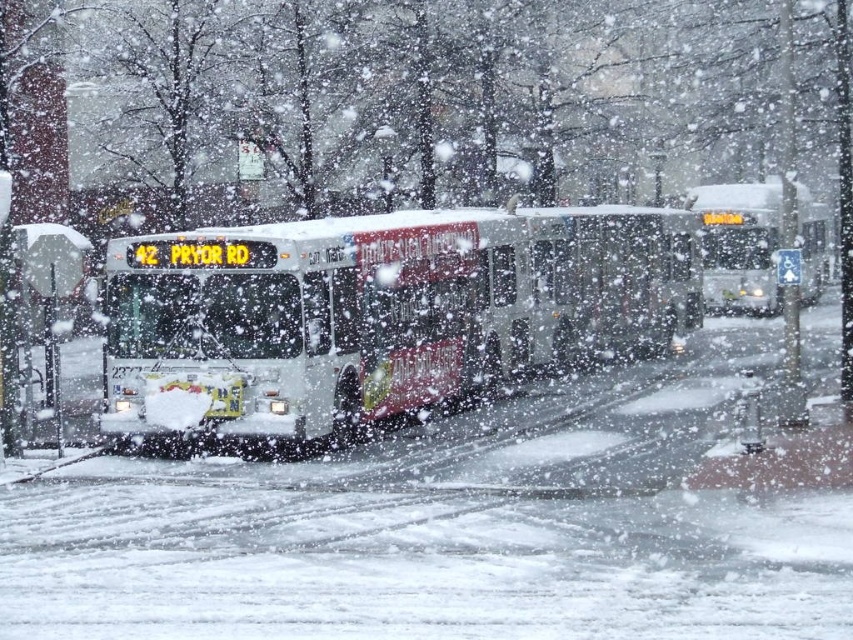
Question: Can you confirm if white glossy bus at center is positioned to the left of metallic silver bus stop at left?

Choices:
 (A) no
 (B) yes

Answer: (A)

Question: Does white glossy bus at center appear under metallic silver bus stop at left?

Choices:
 (A) no
 (B) yes

Answer: (A)

Question: Does white metallic bus at center come in front of metallic silver bus stop at left?

Choices:
 (A) no
 (B) yes

Answer: (B)

Question: Which of the following is the farthest from the observer?

Choices:
 (A) white metallic bus at center
 (B) white glossy bus at center
 (C) metallic silver bus stop at left

Answer: (B)

Question: Based on their relative distances, which object is nearer to the metallic silver bus stop at left?

Choices:
 (A) white glossy bus at center
 (B) white metallic bus at center

Answer: (B)

Question: Which point is closer to the camera taking this photo?

Choices:
 (A) (257, 285)
 (B) (78, 284)

Answer: (A)